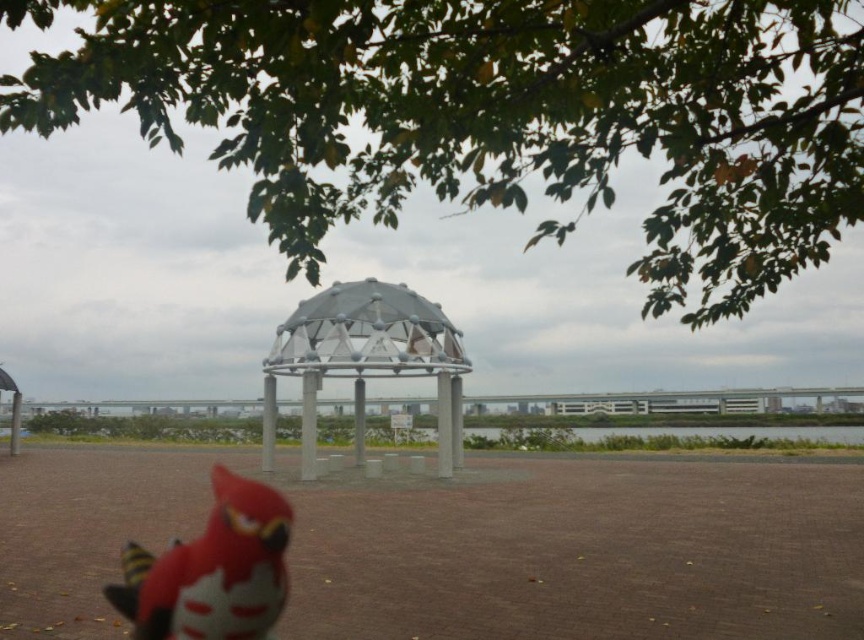
Is green leafy tree at upper center thinner than metallic dome at center?

No, green leafy tree at upper center is not thinner than metallic dome at center.

Who is more distant from viewer, (145,97) or (354,371)?

Positioned behind is point (354,371).

I want to click on green leafy tree at upper center, so click(496, 115).

Can you confirm if green leafy tree at upper center is wider than red matte parrot at lower left?

Yes, green leafy tree at upper center is wider than red matte parrot at lower left.

Can you confirm if green leafy tree at upper center is shorter than red matte parrot at lower left?

No.

Where is `green leafy tree at upper center`? The width and height of the screenshot is (864, 640). green leafy tree at upper center is located at coordinates (496, 115).

Who is more distant from viewer, (346,365) or (213,637)?

Point (346,365)

At what (x,y) coordinates should I click in order to perform the action: click on metallic dome at center. Please return your answer as a coordinate pair (x, y). Image resolution: width=864 pixels, height=640 pixels. Looking at the image, I should click on (365, 358).

Find the location of `metallic dome at center`. metallic dome at center is located at coordinates (365, 358).